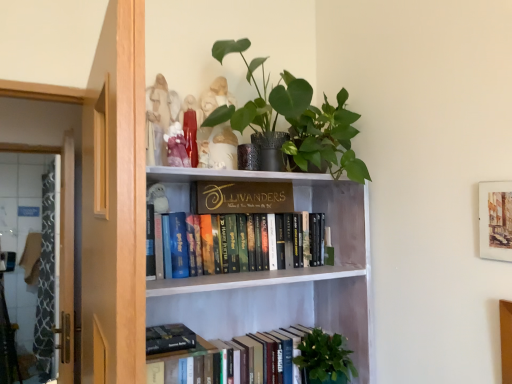
Question: Is white wood bookshelf at upper center wider than green matte plant at lower center?

Choices:
 (A) no
 (B) yes

Answer: (B)

Question: Is white wood bookshelf at upper center shorter than green matte plant at lower center?

Choices:
 (A) no
 (B) yes

Answer: (A)

Question: Is white wood bookshelf at upper center located outside green matte plant at lower center?

Choices:
 (A) no
 (B) yes

Answer: (B)

Question: From a real-world perspective, is white wood bookshelf at upper center beneath green matte plant at lower center?

Choices:
 (A) no
 (B) yes

Answer: (A)

Question: Would you say white wood bookshelf at upper center contains green matte plant at lower center?

Choices:
 (A) yes
 (B) no

Answer: (A)

Question: From the image's perspective, is white wood bookshelf at upper center above or below hardcover books at center, arranged as the second book when ordered from the bottom?

Choices:
 (A) above
 (B) below

Answer: (B)

Question: In the image, is white wood bookshelf at upper center positioned in front of or behind hardcover books at center, the first book from the top?

Choices:
 (A) front
 (B) behind

Answer: (A)

Question: Is white wood bookshelf at upper center situated inside hardcover books at center, the first book from the top, or outside?

Choices:
 (A) outside
 (B) inside

Answer: (A)

Question: Is white wood bookshelf at upper center taller or shorter than hardcover books at center, the first book from the top?

Choices:
 (A) tall
 (B) short

Answer: (A)

Question: From the image's perspective, is gold metallic sign at upper center above or below wooden screen door at left?

Choices:
 (A) below
 (B) above

Answer: (B)

Question: From a real-world perspective, is gold metallic sign at upper center positioned above or below wooden screen door at left?

Choices:
 (A) below
 (B) above

Answer: (B)

Question: Is gold metallic sign at upper center situated inside wooden screen door at left or outside?

Choices:
 (A) outside
 (B) inside

Answer: (A)

Question: Considering the relative positions of gold metallic sign at upper center and wooden screen door at left in the image provided, is gold metallic sign at upper center to the left or to the right of wooden screen door at left?

Choices:
 (A) left
 (B) right

Answer: (B)

Question: In terms of height, does green matte plant at lower center look taller or shorter compared to hardcover books at center, the first book from the top?

Choices:
 (A) short
 (B) tall

Answer: (B)

Question: Do you think green matte plant at lower center is within hardcover books at center, arranged as the second book when ordered from the bottom, or outside of it?

Choices:
 (A) outside
 (B) inside

Answer: (A)